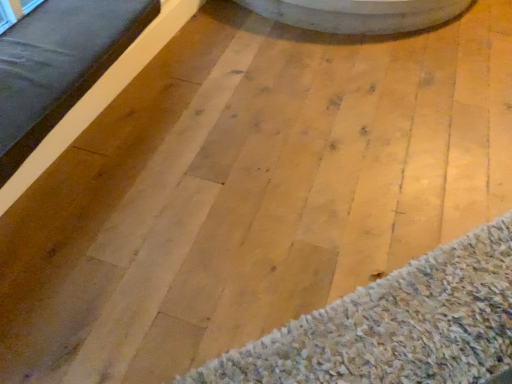
Question: Is woolen carpet at lower right bigger or smaller than matte wood bed frame at left?

Choices:
 (A) small
 (B) big

Answer: (A)

Question: Is woolen carpet at lower right taller or shorter than matte wood bed frame at left?

Choices:
 (A) tall
 (B) short

Answer: (B)

Question: From the image's perspective, is woolen carpet at lower right above or below matte wood bed frame at left?

Choices:
 (A) below
 (B) above

Answer: (A)

Question: Considering the positions of matte wood bed frame at left and woolen carpet at lower right in the image, is matte wood bed frame at left taller or shorter than woolen carpet at lower right?

Choices:
 (A) short
 (B) tall

Answer: (B)

Question: Is point (31, 23) closer or farther from the camera than point (385, 377)?

Choices:
 (A) farther
 (B) closer

Answer: (A)

Question: Considering the relative positions of matte wood bed frame at left and woolen carpet at lower right in the image provided, is matte wood bed frame at left to the left or to the right of woolen carpet at lower right?

Choices:
 (A) left
 (B) right

Answer: (A)

Question: Is matte wood bed frame at left inside the boundaries of woolen carpet at lower right, or outside?

Choices:
 (A) inside
 (B) outside

Answer: (B)